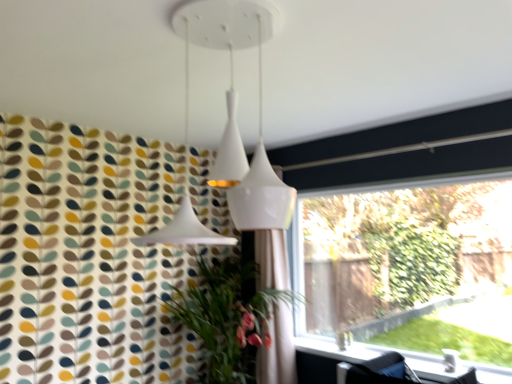
I want to click on transparent glass window at right, so click(x=411, y=273).

What do you see at coordinates (227, 318) in the screenshot? I see `green leafy plant at lower left` at bounding box center [227, 318].

This screenshot has height=384, width=512. Find the location of `transparent glass window at right`. transparent glass window at right is located at coordinates (411, 273).

Considering the positions of objects green leafy plant at lower left and transparent glass window at right in the image provided, who is behind, green leafy plant at lower left or transparent glass window at right?

green leafy plant at lower left is further from the camera.

This screenshot has width=512, height=384. What are the coordinates of `window above the green leafy plant at lower left (from a real-world perspective)` in the screenshot? It's located at (411, 273).

Considering the positions of points (203, 324) and (497, 324), is point (203, 324) closer to camera compared to point (497, 324)?

Yes.

What's the angular difference between green leafy plant at lower left and transparent glass window at right's facing directions?

They differ by 1.19 degrees in their facing directions.

Considering the sizes of objects white glossy window sill at lower right and white fabric shower curtain at center in the image provided, who is bigger, white glossy window sill at lower right or white fabric shower curtain at center?

With larger size is white fabric shower curtain at center.

From a real-world perspective, is white glossy window sill at lower right physically located above or below white fabric shower curtain at center?

From a real-world perspective, white glossy window sill at lower right is physically below white fabric shower curtain at center.

Is white glossy window sill at lower right positioned before white fabric shower curtain at center?

Yes.

From the picture: Between white glossy window sill at lower right and green leafy plant at lower left, which one has less height?

white glossy window sill at lower right.

Which object is wider, white glossy window sill at lower right or green leafy plant at lower left?

green leafy plant at lower left.

Does white glossy window sill at lower right lie behind green leafy plant at lower left?

No, it is not.

In the scene shown: Can you confirm if transparent glass window at right is thinner than white fabric shower curtain at center?

Indeed, transparent glass window at right has a lesser width compared to white fabric shower curtain at center.

Is transparent glass window at right bigger or smaller than white fabric shower curtain at center?

Clearly, transparent glass window at right is larger in size than white fabric shower curtain at center.

Which of these two, transparent glass window at right or white fabric shower curtain at center, stands taller?

With more height is white fabric shower curtain at center.

Based on the photo, does transparent glass window at right come in front of white fabric shower curtain at center?

Yes, the depth of transparent glass window at right is less than that of white fabric shower curtain at center.

Is the surface of green leafy plant at lower left in direct contact with white fabric shower curtain at center?

No, green leafy plant at lower left is not next to white fabric shower curtain at center.

This screenshot has height=384, width=512. I want to click on houseplant on the left of white fabric shower curtain at center, so click(x=227, y=318).

In the image, is green leafy plant at lower left positioned in front of or behind white fabric shower curtain at center?

In the image, green leafy plant at lower left appears in front of white fabric shower curtain at center.

Could you tell me if green leafy plant at lower left is turned towards white fabric shower curtain at center?

No, green leafy plant at lower left is not facing towards white fabric shower curtain at center.

In terms of width, does white glossy window sill at lower right look wider or thinner when compared to transparent glass window at right?

Clearly, white glossy window sill at lower right has more width compared to transparent glass window at right.

Relative to transparent glass window at right, is white glossy window sill at lower right in front or behind?

white glossy window sill at lower right is in front of transparent glass window at right.

From a real-world perspective, between white glossy window sill at lower right and transparent glass window at right, who is vertically higher?

transparent glass window at right is physically above.

Considering the sizes of objects white fabric shower curtain at center and green leafy plant at lower left in the image provided, who is thinner, white fabric shower curtain at center or green leafy plant at lower left?

white fabric shower curtain at center.

Is white fabric shower curtain at center not near green leafy plant at lower left?

white fabric shower curtain at center is actually quite close to green leafy plant at lower left.

From the image's perspective, which is above, white fabric shower curtain at center or green leafy plant at lower left?

white fabric shower curtain at center appears higher in the image.

Is the depth of white fabric shower curtain at center less than that of green leafy plant at lower left?

No, white fabric shower curtain at center is further to the viewer.

The image size is (512, 384). I want to click on houseplant that is under the transparent glass window at right (from a real-world perspective), so click(x=227, y=318).

The image size is (512, 384). I want to click on window sill lying in front of the white fabric shower curtain at center, so click(x=337, y=349).

Based on their spatial positions, is white fabric shower curtain at center or transparent glass window at right further from green leafy plant at lower left?

Among the two, transparent glass window at right is located further to green leafy plant at lower left.

Considering their positions, is transparent glass window at right positioned further to green leafy plant at lower left than white glossy window sill at lower right?

transparent glass window at right.

Which object lies further to the anchor point green leafy plant at lower left, white glossy window sill at lower right or transparent glass window at right?

Among the two, transparent glass window at right is located further to green leafy plant at lower left.

Consider the image. When comparing their distances from transparent glass window at right, does green leafy plant at lower left or white glossy window sill at lower right seem further?

Based on the image, green leafy plant at lower left appears to be further to transparent glass window at right.

From the image, which object appears to be nearer to white fabric shower curtain at center, white glossy window sill at lower right or green leafy plant at lower left?

green leafy plant at lower left.

In the scene shown: Considering their positions, is white glossy window sill at lower right positioned closer to transparent glass window at right than green leafy plant at lower left?

white glossy window sill at lower right.

From the picture: Estimate the real-world distances between objects in this image. Which object is further from green leafy plant at lower left, white fabric shower curtain at center or white glossy window sill at lower right?

The object further to green leafy plant at lower left is white glossy window sill at lower right.

Looking at the image, which one is located closer to transparent glass window at right, white fabric shower curtain at center or green leafy plant at lower left?

The object closer to transparent glass window at right is white fabric shower curtain at center.

Locate an element on the screen. The height and width of the screenshot is (384, 512). shower curtain situated between green leafy plant at lower left and transparent glass window at right from left to right is located at coordinates (278, 350).

Image resolution: width=512 pixels, height=384 pixels. Find the location of `window sill between green leafy plant at lower left and transparent glass window at right in the horizontal direction`. window sill between green leafy plant at lower left and transparent glass window at right in the horizontal direction is located at coordinates (337, 349).

Where is `shower curtain located between green leafy plant at lower left and white glossy window sill at lower right in the left-right direction`? The image size is (512, 384). shower curtain located between green leafy plant at lower left and white glossy window sill at lower right in the left-right direction is located at coordinates (278, 350).

Identify the location of window sill situated between white fabric shower curtain at center and transparent glass window at right from left to right. (337, 349).